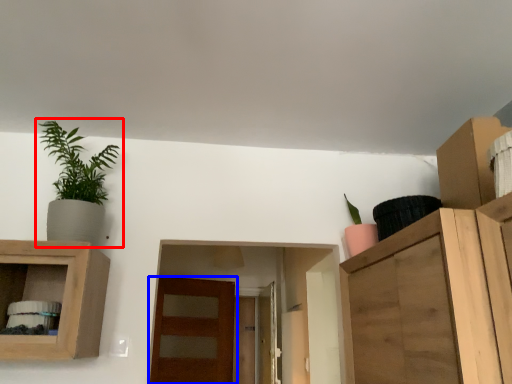
Question: Which object appears closest to the camera in this image, houseplant (highlighted by a red box) or door (highlighted by a blue box)?

Choices:
 (A) houseplant
 (B) door

Answer: (A)